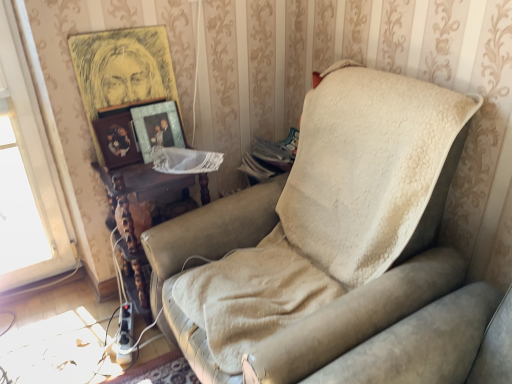
Question: Is leather studio couch at center situated inside metallic gold picture frame at upper center, the second picture frame when ordered from top to bottom, or outside?

Choices:
 (A) inside
 (B) outside

Answer: (B)

Question: Would you say leather studio couch at center is to the left or to the right of metallic gold picture frame at upper center, the second picture frame when ordered from top to bottom, in the picture?

Choices:
 (A) left
 (B) right

Answer: (B)

Question: Estimate the real-world distances between objects in this image. Which object is farther from the leather studio couch at center?

Choices:
 (A) metallic gold picture frame at upper center, placed as the 2th picture frame when sorted from bottom to top
 (B) wooden picture frame at upper left, arranged as the third picture frame when ordered from the bottom
 (C) woodenobject at left, acting as the first picture frame starting from the bottom
 (D) woodenmaterial/texturetable at center

Answer: (C)

Question: Based on their relative distances, which object is nearer to the woodenmaterial/texturetable at center?

Choices:
 (A) woodenobject at left, the 3th picture frame viewed from the top
 (B) leather studio couch at center
 (C) metallic gold picture frame at upper center, placed as the 2th picture frame when sorted from bottom to top
 (D) wooden picture frame at upper left, the first picture frame positioned from the top

Answer: (A)